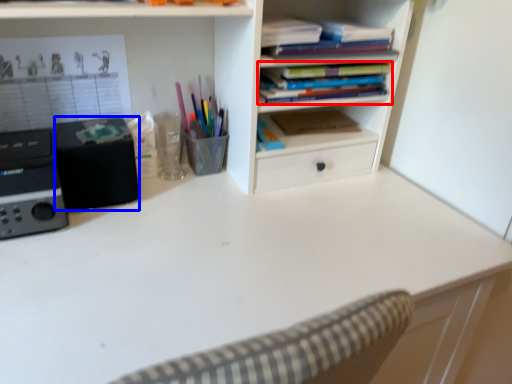
Question: Which object is closer to the camera taking this photo, book (highlighted by a red box) or speaker (highlighted by a blue box)?

Choices:
 (A) book
 (B) speaker

Answer: (B)